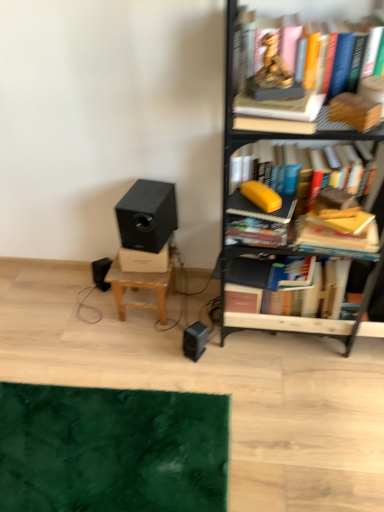
Identify the location of free spot above gold metallic statue at upper center, the 3th paperback book from the bottom (from a real-world perspective). The image size is (384, 512). (282, 93).